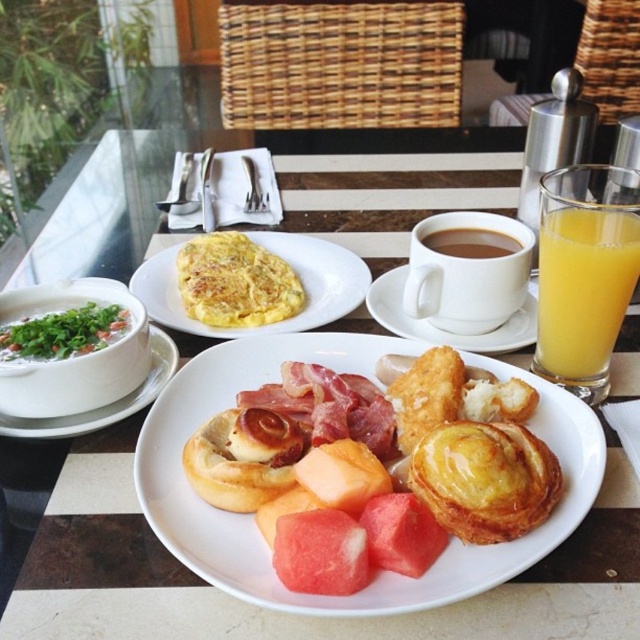
Question: Which point appears farthest from the camera in this image?

Choices:
 (A) (172, 365)
 (B) (481, 515)

Answer: (A)

Question: Considering the real-world distances, which object is closest to the brown matte cup at center?

Choices:
 (A) white ceramic cup at center
 (B) white ceramic cup at upper center

Answer: (B)

Question: Does yellow omelette at center appear over brown matte cup at center?

Choices:
 (A) no
 (B) yes

Answer: (A)

Question: Can you confirm if white ceramic cup at center is smaller than green leafy soup at left?

Choices:
 (A) yes
 (B) no

Answer: (B)

Question: Which of these objects is positioned farthest from the white glossy plate at center?

Choices:
 (A) yellow omelette at center
 (B) white ceramic cup at upper center

Answer: (A)

Question: Is white ceramic cup at upper center below white ceramic bowl at left?

Choices:
 (A) yes
 (B) no

Answer: (B)